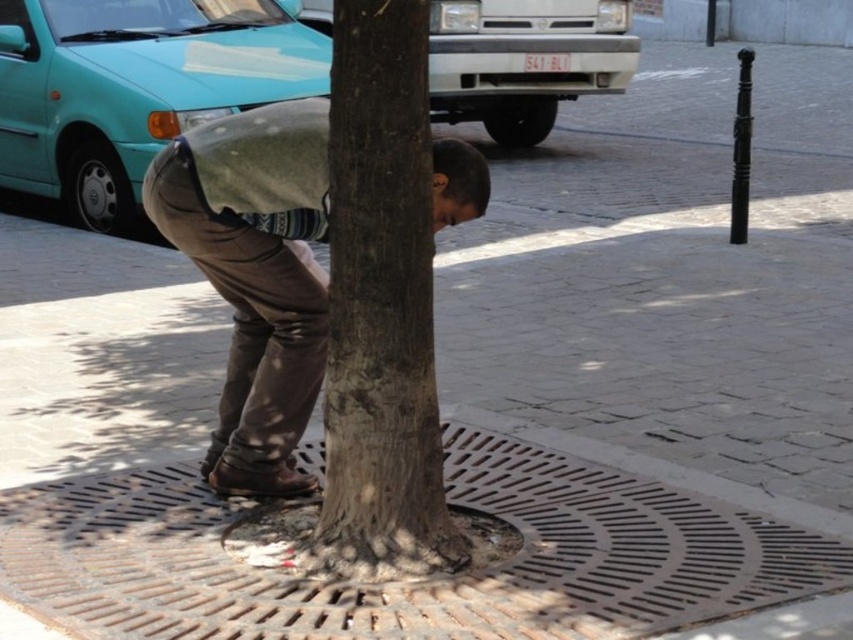
Question: Where is brown rough bark at center located in relation to brown leather pants at center in the image?

Choices:
 (A) right
 (B) left

Answer: (A)

Question: Which point is farther to the camera?

Choices:
 (A) brown rough bark at center
 (B) brown leather pants at center

Answer: (B)

Question: Does brown rough bark at center appear over brown leather pants at center?

Choices:
 (A) no
 (B) yes

Answer: (B)

Question: Considering the relative positions of brown rough bark at center and brown leather pants at center in the image provided, where is brown rough bark at center located with respect to brown leather pants at center?

Choices:
 (A) above
 (B) below

Answer: (A)